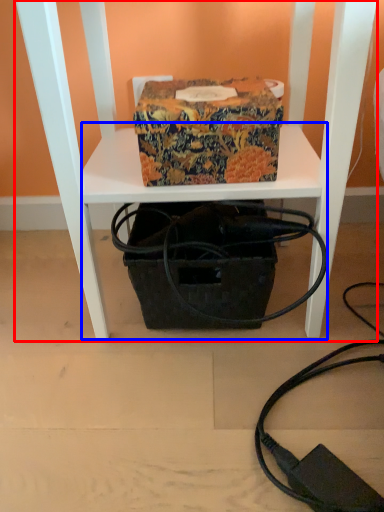
Question: Among these objects, which one is nearest to the camera, furniture (highlighted by a red box) or table (highlighted by a blue box)?

Choices:
 (A) furniture
 (B) table

Answer: (A)